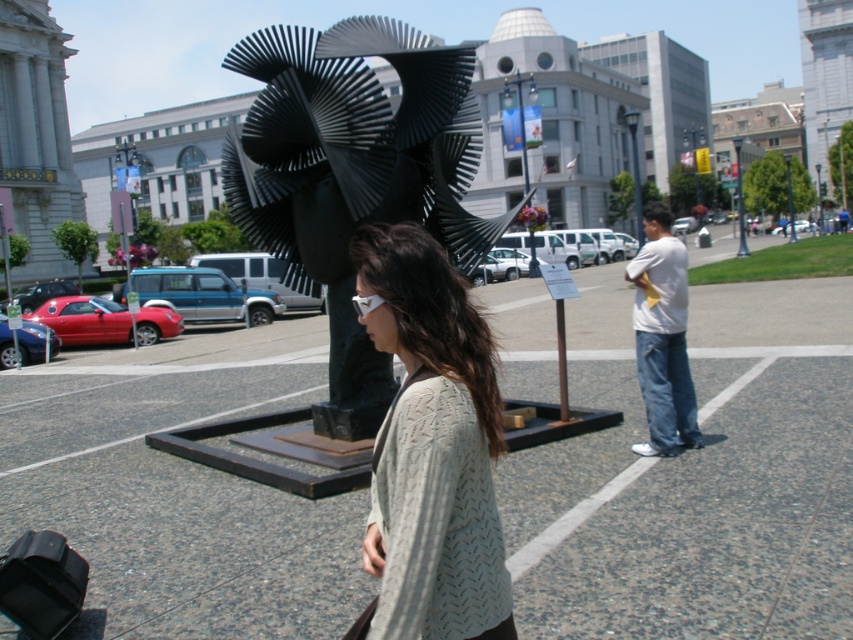
Consider the image. Does knitted gray sweater at center have a greater width compared to white cotton shirt at right?

No, knitted gray sweater at center is not wider than white cotton shirt at right.

Does knitted gray sweater at center have a lesser height compared to white cotton shirt at right?

Yes.

This screenshot has width=853, height=640. Describe the element at coordinates (431, 445) in the screenshot. I see `knitted gray sweater at center` at that location.

At what (x,y) coordinates should I click in order to perform the action: click on knitted gray sweater at center. Please return your answer as a coordinate pair (x, y). Image resolution: width=853 pixels, height=640 pixels. Looking at the image, I should click on 431,445.

Which of these two, black metal sculpture at center or metallic streetlight at upper center, stands shorter?

black metal sculpture at center is shorter.

Which is more to the right, black metal sculpture at center or metallic streetlight at upper center?

metallic streetlight at upper center

Does point (421, 72) come closer to viewer compared to point (634, 209)?

Yes, point (421, 72) is in front of point (634, 209).

The image size is (853, 640). What are the coordinates of `black metal sculpture at center` in the screenshot? It's located at (352, 173).

Does white cotton shirt at right lie in front of metallic pole at upper right?

Yes.

Can you confirm if white cotton shirt at right is positioned below metallic pole at upper right?

Indeed, white cotton shirt at right is positioned under metallic pole at upper right.

At what (x,y) coordinates should I click in order to perform the action: click on white cotton shirt at right. Please return your answer as a coordinate pair (x, y). Looking at the image, I should click on (662, 337).